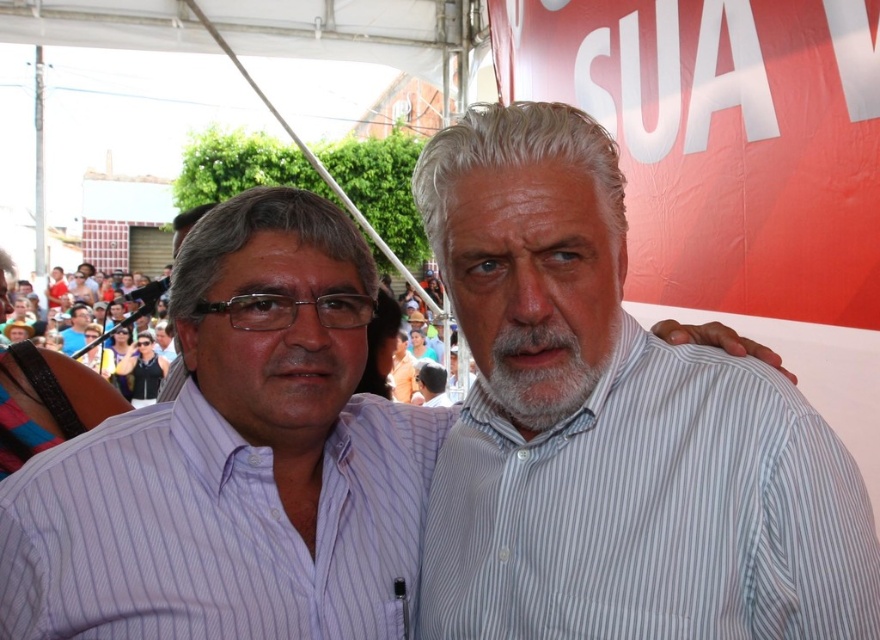
Who is more distant from viewer, (134, 532) or (92, 348)?

The point (92, 348) is more distant.

Is purple striped shirt at center above multicolored fabric crowd at center?

No.

Between point (108, 499) and point (141, 310), which one is positioned in front?

Point (108, 499) is in front.

Where is `purple striped shirt at center`? purple striped shirt at center is located at coordinates (215, 529).

Does white striped shirt at center appear over white striped shirt at right?

Actually, white striped shirt at center is below white striped shirt at right.

You are a GUI agent. You are given a task and a screenshot of the screen. Output one action in this format:
    pyautogui.click(x=<x>, y=<y>)
    Task: Click on the white striped shirt at center
    This screenshot has height=640, width=880.
    Given the screenshot: What is the action you would take?
    pyautogui.click(x=235, y=461)

Is point (309, 547) positioned in front of point (558, 600)?

No.

Where is `white striped shirt at center`? The image size is (880, 640). white striped shirt at center is located at coordinates (235, 461).

Does point (206, 412) come farther from viewer compared to point (57, 566)?

That is True.

Who is more distant from viewer, (215,502) or (207,579)?

Positioned behind is point (215,502).

Image resolution: width=880 pixels, height=640 pixels. Describe the element at coordinates (235, 461) in the screenshot. I see `white striped shirt at center` at that location.

This screenshot has width=880, height=640. In order to click on white striped shirt at center in this screenshot , I will do pos(235,461).